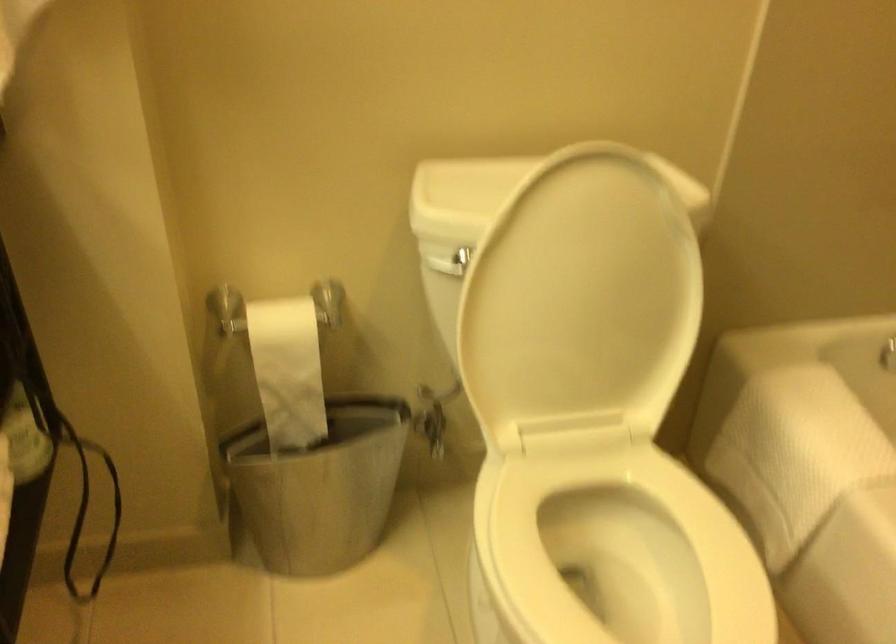
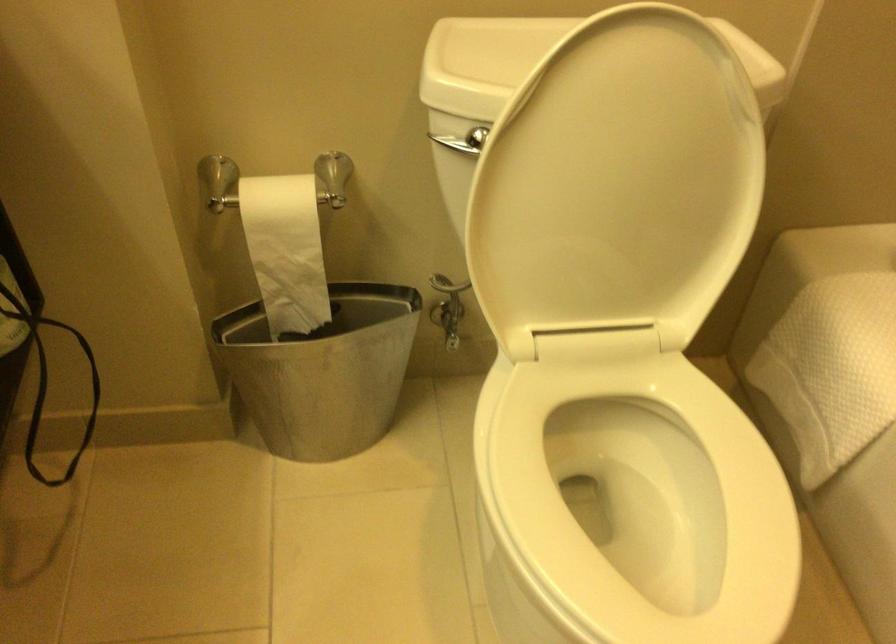
Where in the second image is the point corresponding to (x=582, y=295) from the first image?

(617, 183)